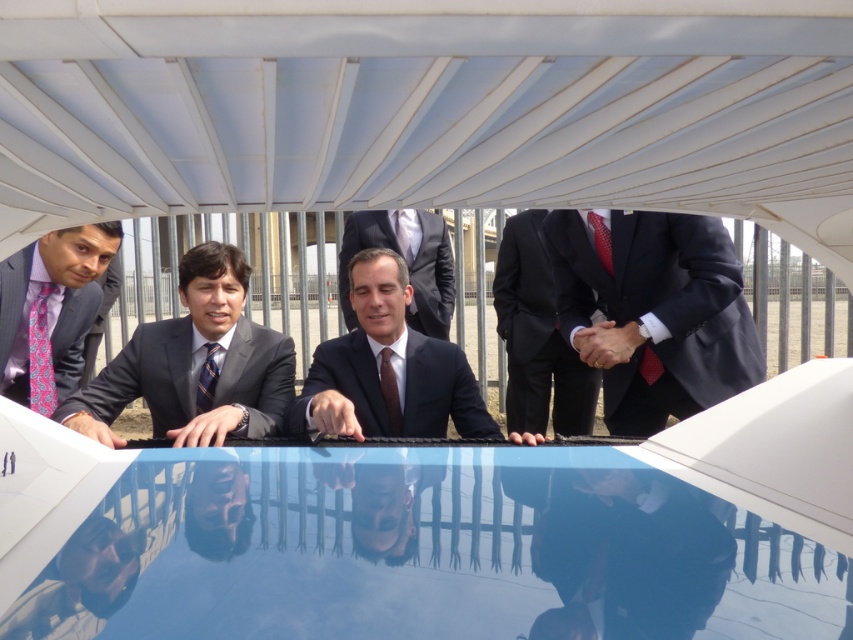
Question: Which point is closer to the camera?

Choices:
 (A) (399, 410)
 (B) (70, 419)
 (C) (577, 429)
 (D) (82, 349)

Answer: (B)

Question: Does matte black suit at center appear under matte black suit at left?

Choices:
 (A) yes
 (B) no

Answer: (B)

Question: Estimate the real-world distances between objects in this image. Which object is closer to the navy blue suit at center?

Choices:
 (A) red dotted tie at right
 (B) dark blue suit at center
 (C) matte black tie at center
 (D) matte black suit at left

Answer: (A)

Question: Which object appears closest to the camera in this image?

Choices:
 (A) matte purple tie at left
 (B) matte gray suit at center
 (C) red dotted tie at right
 (D) red dotted fabric tie at right

Answer: (B)

Question: Considering the relative positions of dark blue suit at right and pink patterned tie at left in the image provided, where is dark blue suit at right located with respect to pink patterned tie at left?

Choices:
 (A) below
 (B) above

Answer: (B)

Question: In this image, where is matte gray suit at center located relative to pink patterned tie at left?

Choices:
 (A) right
 (B) left

Answer: (A)